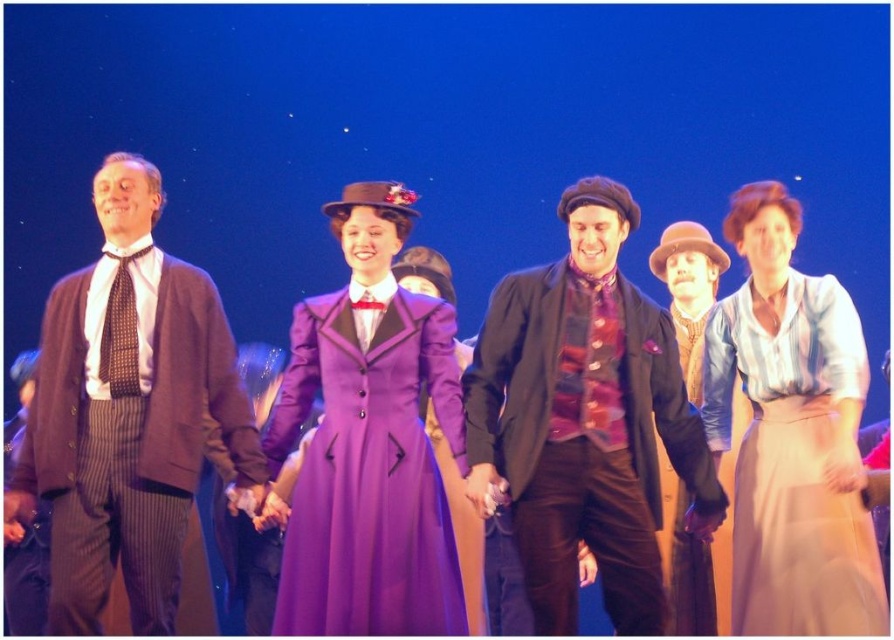
Question: Which object is farther from the camera taking this photo?

Choices:
 (A) purple satin dress at center
 (B) velvet black coat at center
 (C) striped wool suit at left

Answer: (C)

Question: Which object is farther from the camera taking this photo?

Choices:
 (A) purple satin dress at center
 (B) velvet black coat at center
 (C) striped wool suit at left

Answer: (C)

Question: Which of the following is the closest to the observer?

Choices:
 (A) purple satin dress at center
 (B) velvet black coat at center
 (C) striped wool suit at left
 (D) striped cotton blouse at right

Answer: (D)

Question: Does velvet black coat at center have a smaller size compared to purple satin dress at center?

Choices:
 (A) yes
 (B) no

Answer: (B)

Question: In this image, where is velvet black coat at center located relative to purple satin dress at center?

Choices:
 (A) below
 (B) above

Answer: (B)

Question: Is velvet black coat at center to the right of purple satin dress at center from the viewer's perspective?

Choices:
 (A) no
 (B) yes

Answer: (B)